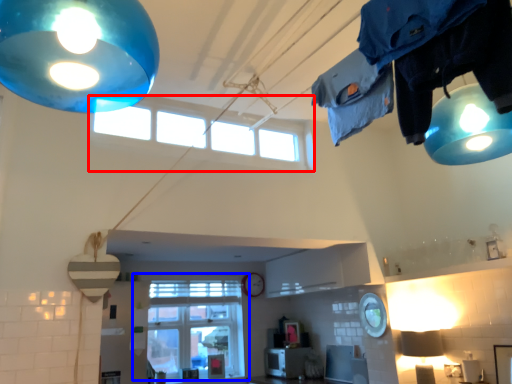
Question: Which object appears closest to the camera in this image, window (highlighted by a red box) or window (highlighted by a blue box)?

Choices:
 (A) window
 (B) window

Answer: (A)